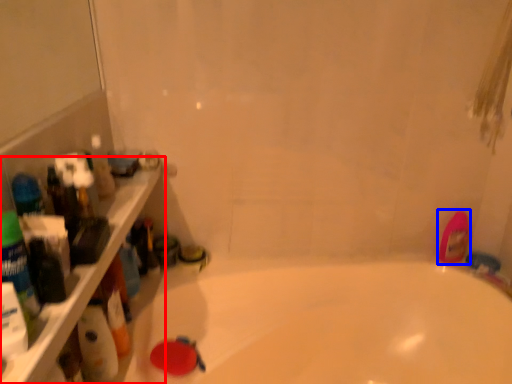
Question: Which object is closer to the camera taking this photo, ledge (highlighted by a red box) or mouthwash (highlighted by a blue box)?

Choices:
 (A) ledge
 (B) mouthwash

Answer: (A)